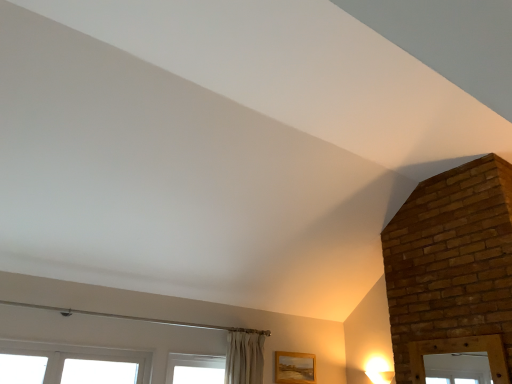
Question: Should I look upward or downward to see wooden frame at lower right?

Choices:
 (A) down
 (B) up

Answer: (A)

Question: From a real-world perspective, is wooden frame at lower right physically above white plastic window at lower left?

Choices:
 (A) no
 (B) yes

Answer: (B)

Question: Is wooden frame at lower right aimed at white plastic window at lower left?

Choices:
 (A) no
 (B) yes

Answer: (A)

Question: Is wooden frame at lower right behind white plastic window at lower left?

Choices:
 (A) no
 (B) yes

Answer: (B)

Question: From the image's perspective, is wooden frame at lower right beneath white plastic window at lower left?

Choices:
 (A) no
 (B) yes

Answer: (B)

Question: Considering the relative positions of wooden frame at lower right and white plastic window at lower left in the image provided, is wooden frame at lower right to the left of white plastic window at lower left from the viewer's perspective?

Choices:
 (A) yes
 (B) no

Answer: (B)

Question: Is there a large distance between wooden frame at lower right and white plastic window at lower left?

Choices:
 (A) yes
 (B) no

Answer: (A)

Question: From a real-world perspective, is white plastic window at lower left on top of wooden frame at lower right?

Choices:
 (A) no
 (B) yes

Answer: (A)

Question: Is white plastic window at lower left further to the viewer compared to wooden frame at lower right?

Choices:
 (A) no
 (B) yes

Answer: (A)

Question: Can we say white plastic window at lower left lies outside wooden frame at lower right?

Choices:
 (A) yes
 (B) no

Answer: (A)

Question: Is white plastic window at lower left oriented towards wooden frame at lower right?

Choices:
 (A) yes
 (B) no

Answer: (B)

Question: Is white plastic window at lower left to the left of wooden frame at lower right from the viewer's perspective?

Choices:
 (A) no
 (B) yes

Answer: (B)

Question: Does white plastic window at lower left lie in front of wooden frame at lower right?

Choices:
 (A) yes
 (B) no

Answer: (A)

Question: Could you tell me if matte white light fixture at lower right is facing wooden frame at lower right?

Choices:
 (A) yes
 (B) no

Answer: (A)